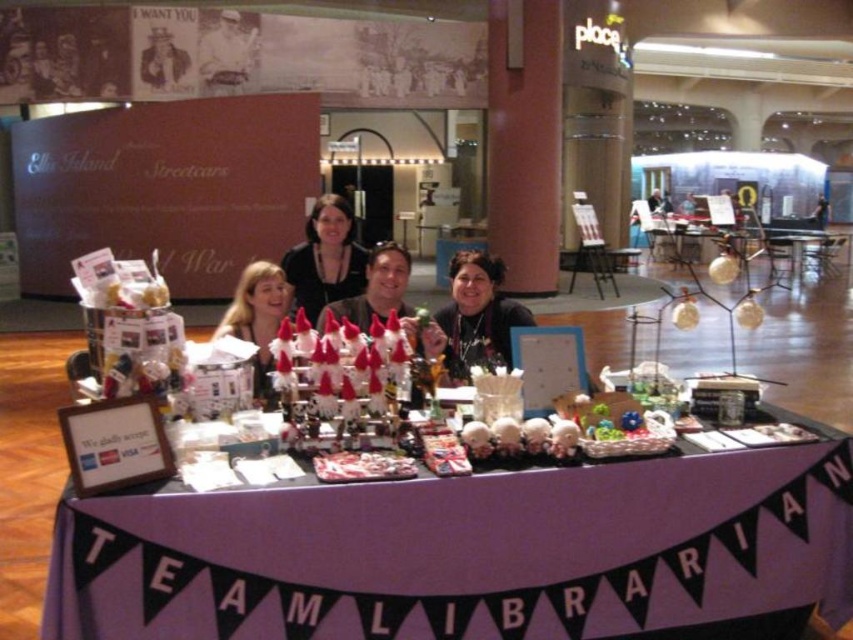
Question: Which point appears closest to the camera in this image?

Choices:
 (A) (248, 305)
 (B) (306, 266)
 (C) (701, 477)
 (D) (474, 284)

Answer: (C)

Question: Considering the relative positions of purple fabric at center and matte black sweater at center in the image provided, where is purple fabric at center located with respect to matte black sweater at center?

Choices:
 (A) below
 (B) above

Answer: (A)

Question: Can you confirm if matte black sweater at center is positioned to the left of blonde hair at center?

Choices:
 (A) no
 (B) yes

Answer: (A)

Question: Which point is farther to the camera?

Choices:
 (A) purple fabric at center
 (B) matte black shirt at center

Answer: (B)

Question: Is purple fabric at center smaller than matte black sweater at center?

Choices:
 (A) no
 (B) yes

Answer: (A)

Question: Which point is closer to the camera?

Choices:
 (A) matte black shirt at center
 (B) matte black sweater at center
 (C) blonde hair at center
 (D) purple fabric at center

Answer: (D)